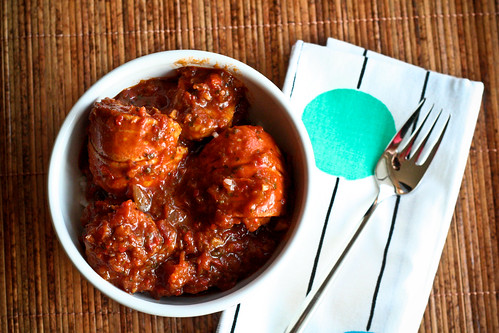
The width and height of the screenshot is (499, 333). Identify the location of fork. (389, 183).